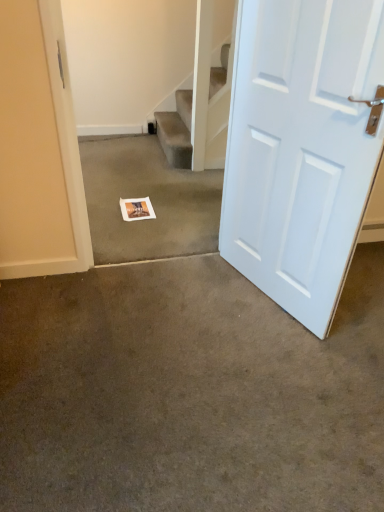
Question: Considering the relative sizes of white paper postcard at center and brown carpet at center, marked as the first concrete in a bottom-to-top arrangement, in the image provided, is white paper postcard at center taller than brown carpet at center, marked as the first concrete in a bottom-to-top arrangement,?

Choices:
 (A) no
 (B) yes

Answer: (A)

Question: Is white paper postcard at center not within brown carpet at center, acting as the first concrete starting from the front?

Choices:
 (A) yes
 (B) no

Answer: (A)

Question: From a real-world perspective, is white paper postcard at center located higher than brown carpet at center, acting as the first concrete starting from the front?

Choices:
 (A) no
 (B) yes

Answer: (B)

Question: Does white paper postcard at center have a lesser height compared to brown carpet at center, arranged as the second concrete when viewed from the back?

Choices:
 (A) yes
 (B) no

Answer: (A)

Question: From the image's perspective, would you say white paper postcard at center is positioned over brown carpet at center, arranged as the 2th concrete when viewed from the top?

Choices:
 (A) no
 (B) yes

Answer: (B)

Question: Is point (107, 215) closer or farther from the camera than point (66, 367)?

Choices:
 (A) farther
 (B) closer

Answer: (A)

Question: Is white paper at center, which appears as the 2th concrete when viewed from the front, spatially inside brown carpet at center, marked as the first concrete in a bottom-to-top arrangement, or outside of it?

Choices:
 (A) inside
 (B) outside

Answer: (B)

Question: Considering the positions of white paper at center, the 2th concrete positioned from the bottom, and brown carpet at center, arranged as the second concrete when viewed from the back, in the image, is white paper at center, the 2th concrete positioned from the bottom, bigger or smaller than brown carpet at center, arranged as the second concrete when viewed from the back,?

Choices:
 (A) big
 (B) small

Answer: (A)

Question: Relative to brown carpet at center, acting as the first concrete starting from the front, is white paper at center, which appears as the 2th concrete when viewed from the front, in front or behind?

Choices:
 (A) behind
 (B) front

Answer: (A)

Question: Is brown carpet at center, arranged as the 2th concrete when viewed from the top, wider or thinner than white paper at center, the 2th concrete positioned from the bottom?

Choices:
 (A) wide
 (B) thin

Answer: (B)

Question: In the image, is brown carpet at center, arranged as the second concrete when viewed from the back, on the left side or the right side of white paper at center, the 1th concrete viewed from the top?

Choices:
 (A) right
 (B) left

Answer: (A)

Question: Considering the positions of brown carpet at center, arranged as the 2th concrete when viewed from the top, and white paper at center, which appears as the 2th concrete when viewed from the front, in the image, is brown carpet at center, arranged as the 2th concrete when viewed from the top, taller or shorter than white paper at center, which appears as the 2th concrete when viewed from the front,?

Choices:
 (A) tall
 (B) short

Answer: (B)

Question: Is brown carpet at center, marked as the first concrete in a bottom-to-top arrangement, in front of or behind white paper at center, the 2th concrete positioned from the bottom, in the image?

Choices:
 (A) front
 (B) behind

Answer: (A)

Question: In the image, is white paper at center, the 1th concrete viewed from the top, positioned in front of or behind white matte door at right?

Choices:
 (A) front
 (B) behind

Answer: (B)

Question: Considering the positions of point [x=218, y=196] and point [x=276, y=10], is point [x=218, y=196] closer or farther from the camera than point [x=276, y=10]?

Choices:
 (A) closer
 (B) farther

Answer: (B)